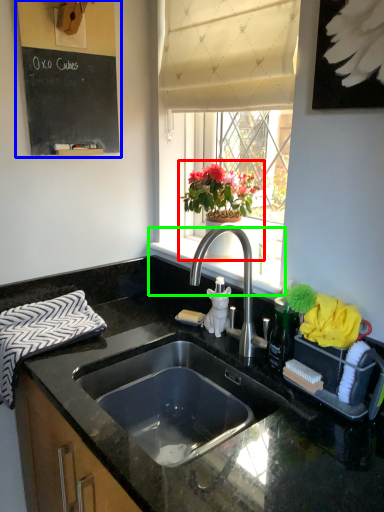
Question: Which object is positioned farthest from houseplant (highlighted by a red box)? Select from bulletin board (highlighted by a blue box) and window sill (highlighted by a green box).

Choices:
 (A) bulletin board
 (B) window sill

Answer: (A)